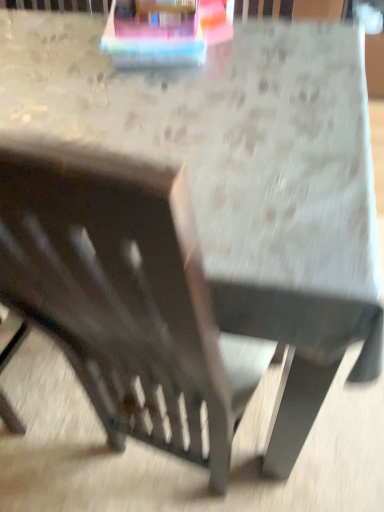
At what (x,y) coordinates should I click in order to perform the action: click on wooden chair at center. Please return your answer as a coordinate pair (x, y). Looking at the image, I should click on (124, 295).

This screenshot has height=512, width=384. What do you see at coordinates (124, 295) in the screenshot? I see `wooden chair at center` at bounding box center [124, 295].

I want to click on wooden chair at center, so click(124, 295).